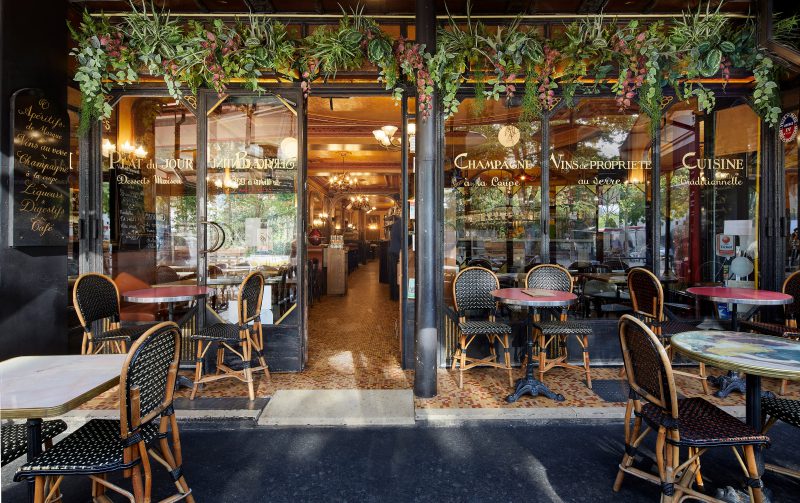
At what (x,y) coordinates should I click in order to perform the action: click on tables. Please return your answer as a coordinate pair (x, y). This screenshot has height=503, width=800. Looking at the image, I should click on (746, 294), (753, 348), (518, 295), (168, 294), (60, 384).